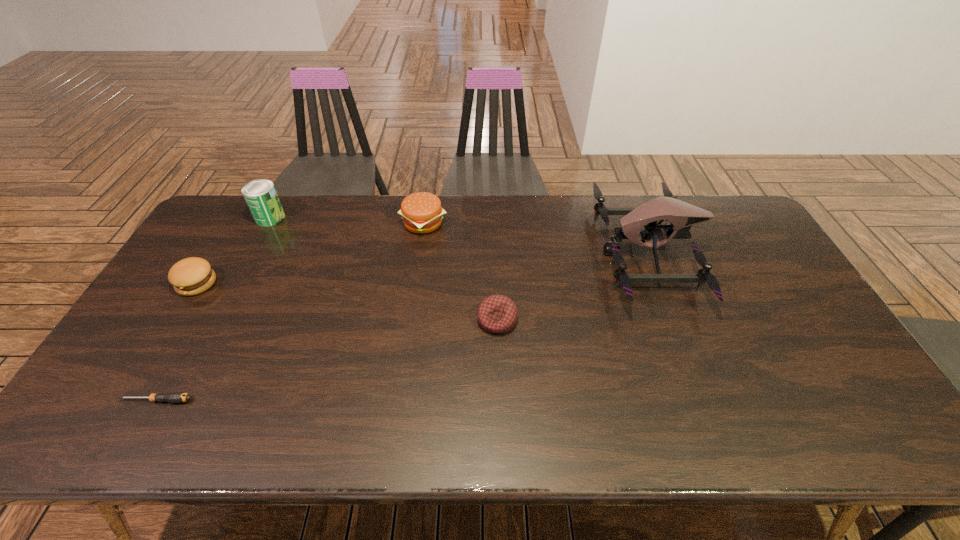
This screenshot has height=540, width=960. Find the location of `the fourth closest object relative to the can`. the fourth closest object relative to the can is located at coordinates (497, 314).

Locate which object ranks fourth in proximity to the left hamburger. Please provide its 2D coordinates. Your answer should be formatted as a tuple, i.e. [(x, y)], where the tuple contains the x and y coordinates of a point satisfying the conditions above.

[(497, 314)]

Where is `free spot that satisfies the following two spatial constraints: 1. on the back side of the can; 2. on the right side of the screwdriver`? free spot that satisfies the following two spatial constraints: 1. on the back side of the can; 2. on the right side of the screwdriver is located at coordinates (258, 218).

Where is `free space in the image that satisfies the following two spatial constraints: 1. on the back side of the taller hamburger; 2. on the right side of the left hamburger`? The width and height of the screenshot is (960, 540). free space in the image that satisfies the following two spatial constraints: 1. on the back side of the taller hamburger; 2. on the right side of the left hamburger is located at coordinates (233, 223).

Identify the location of free spot that satisfies the following two spatial constraints: 1. on the front side of the beanbag; 2. on the left side of the can. The height and width of the screenshot is (540, 960). (216, 320).

What are the coordinates of `vacant space that satisfies the following two spatial constraints: 1. on the front side of the second object from right to left; 2. on the right side of the second tallest object` in the screenshot? It's located at (216, 320).